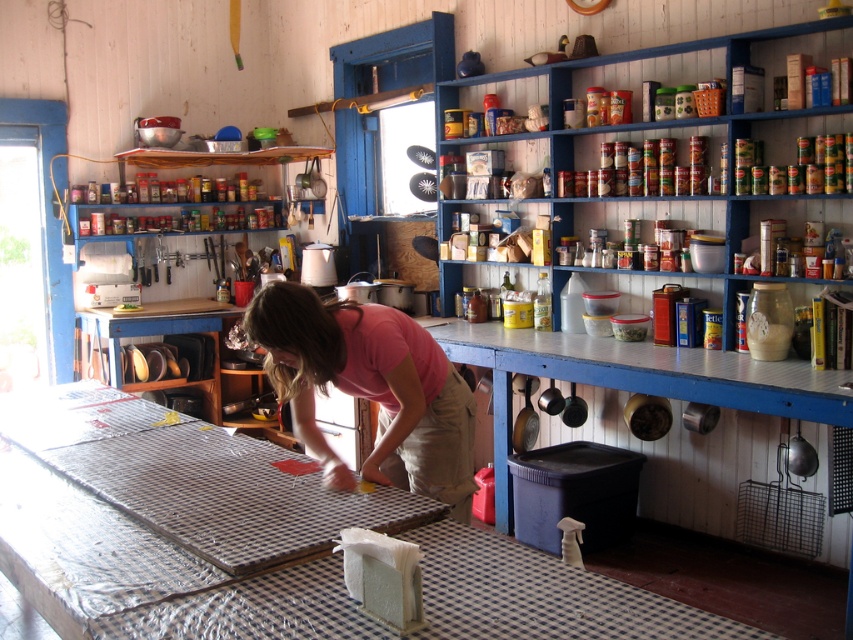
Question: Is checkered fabric workbench at center further to camera compared to blue painted wood shelves at upper right?

Choices:
 (A) yes
 (B) no

Answer: (B)

Question: Which of these objects is positioned farthest from the pink fabric at center?

Choices:
 (A) metallic cans at upper center
 (B) blue painted wood shelves at upper right
 (C) checkered fabric workbench at center

Answer: (A)

Question: Among these points, which one is farthest from the camera?

Choices:
 (A) (679, 122)
 (B) (630, 204)
 (C) (192, 616)

Answer: (B)

Question: In this image, where is blue painted wood shelves at upper right located relative to pink fabric at center?

Choices:
 (A) right
 (B) left

Answer: (A)

Question: Is pink fabric at center bigger than metallic cans at upper center?

Choices:
 (A) no
 (B) yes

Answer: (B)

Question: Among these objects, which one is farthest from the camera?

Choices:
 (A) pink fabric at center
 (B) blue painted wood shelves at upper right
 (C) metallic cans at upper center
 (D) checkered fabric workbench at center

Answer: (C)